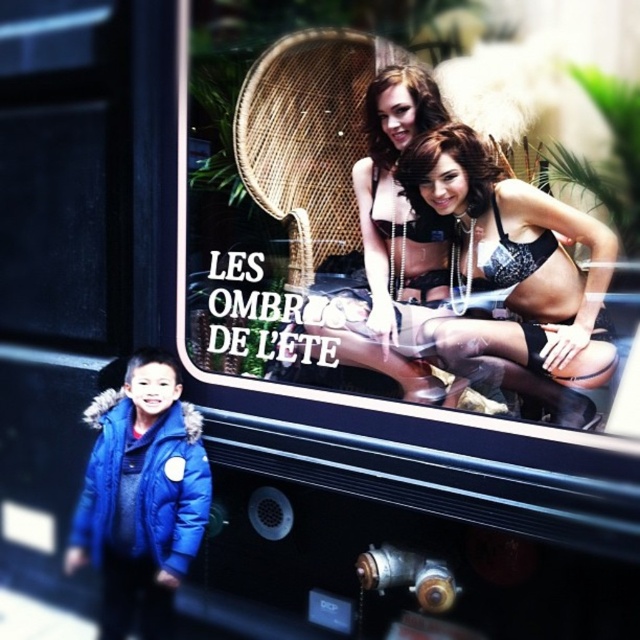
Question: Does satin black lingerie at center have a greater width compared to shiny brown hair at upper center?

Choices:
 (A) no
 (B) yes

Answer: (B)

Question: Considering the real-world distances, which object is closest to the shiny brown hair at center?

Choices:
 (A) metallic gold chair at upper center
 (B) blue down jacket at left
 (C) shiny brown hair at upper center
 (D) satin black lingerie at center

Answer: (C)

Question: Which point is closer to the camera?

Choices:
 (A) (291, 150)
 (B) (525, 220)

Answer: (B)

Question: Can you confirm if metallic gold chair at upper center is positioned to the left of satin black lingerie at center?

Choices:
 (A) yes
 (B) no

Answer: (A)

Question: Does shiny brown hair at center have a larger size compared to shiny brown hair at upper center?

Choices:
 (A) no
 (B) yes

Answer: (B)

Question: Among these objects, which one is farthest from the camera?

Choices:
 (A) blue down jacket at left
 (B) shiny brown hair at center
 (C) metallic gold chair at upper center

Answer: (A)